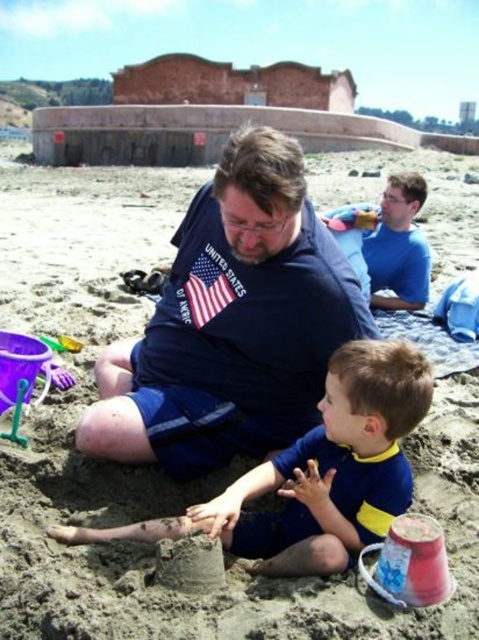
Between point (387, 419) and point (339, 218), which one is positioned in front?

Positioned in front is point (387, 419).

Is blue/yellow swimsuit at center closer to camera compared to blue smooth shirt at upper right?

Yes, it is.

Between point (417, 397) and point (381, 228), which one is positioned in front?

Point (417, 397) is in front.

Locate an element on the screen. The image size is (479, 640). blue/yellow swimsuit at center is located at coordinates (317, 474).

Is blue smooth shirt at upper right closer to camera compared to plastic bucket at lower right?

No, blue smooth shirt at upper right is behind plastic bucket at lower right.

Which is more to the right, blue smooth shirt at upper right or plastic bucket at lower right?

From the viewer's perspective, blue smooth shirt at upper right appears more on the right side.

Is point (387, 209) more distant than point (432, 602)?

Yes, it is behind point (432, 602).

I want to click on blue smooth shirt at upper right, so click(x=399, y=246).

Which of these two, blue/yellow swimsuit at center or plastic bucket at lower right, stands taller?

blue/yellow swimsuit at center

Is blue/yellow swimsuit at center wider than plastic bucket at lower right?

Indeed, blue/yellow swimsuit at center has a greater width compared to plastic bucket at lower right.

Is point (362, 364) positioned after point (368, 552)?

No.

Locate an element on the screen. The height and width of the screenshot is (640, 479). blue/yellow swimsuit at center is located at coordinates (317, 474).